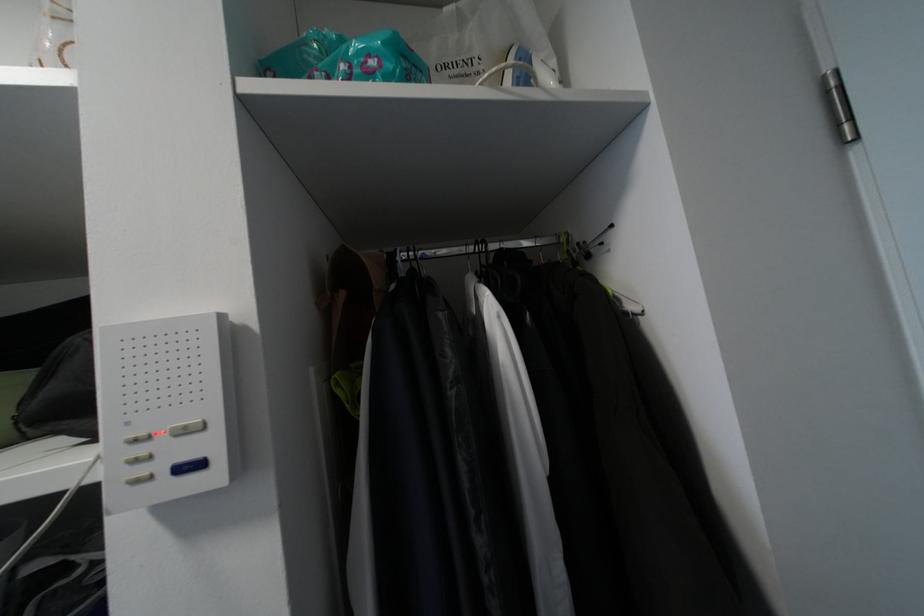
Where would you push the white control button? Please return your answer as a coordinate pair (x, y).

(187, 428)